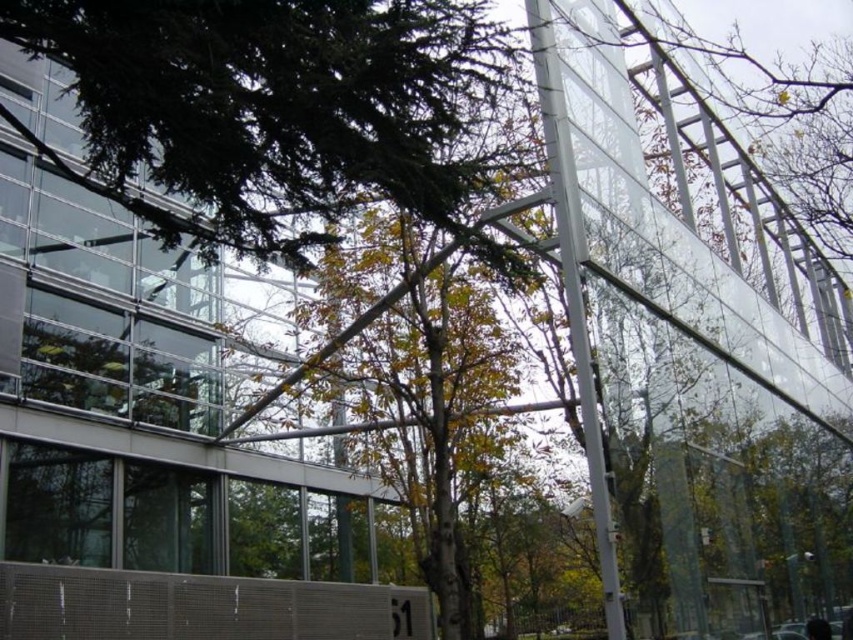
Is green leafy tree at upper center shorter than green leafy tree at center?

Correct, green leafy tree at upper center is not as tall as green leafy tree at center.

Which is above, green leafy tree at upper center or green leafy tree at center?

green leafy tree at upper center

Where is `green leafy tree at upper center`? green leafy tree at upper center is located at coordinates (283, 109).